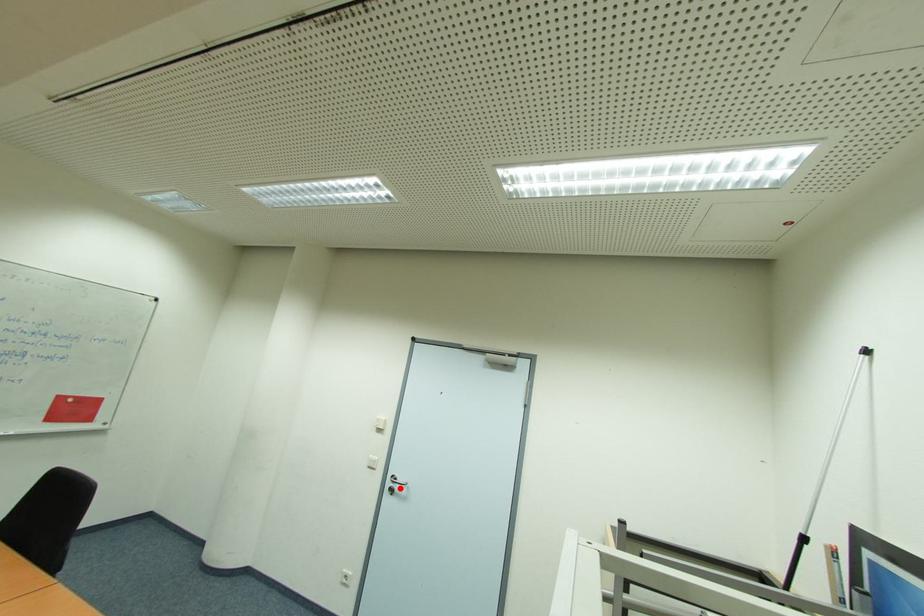
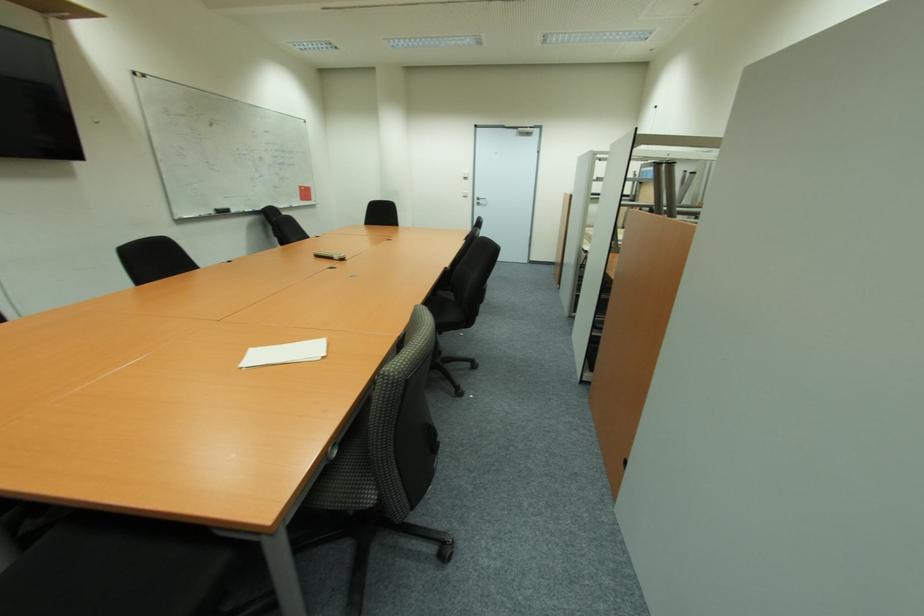
Where in the second image is the point corresponding to the highlighted location from the first image?

(483, 203)